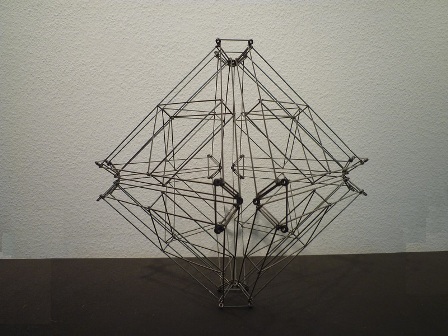
Identify the location of table. [121, 288], [393, 295].